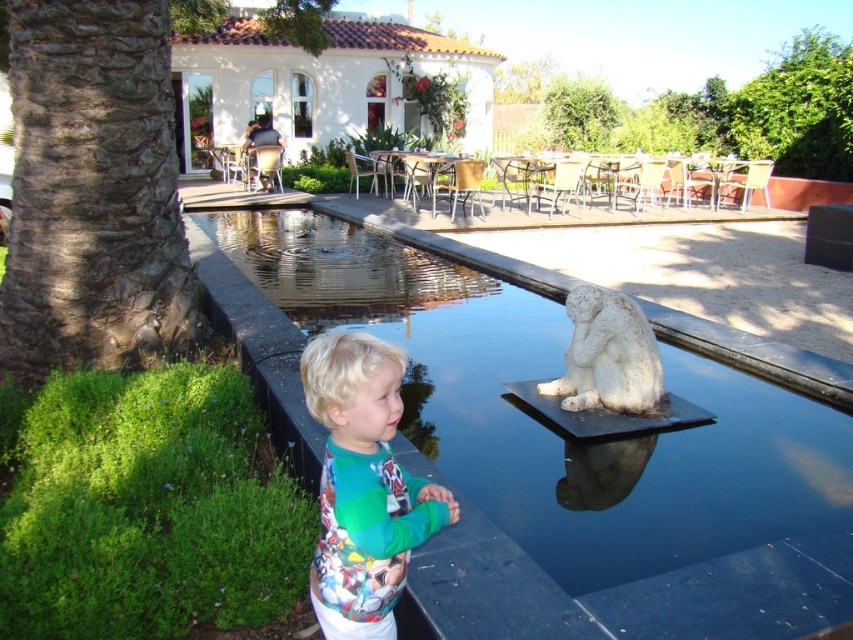
You are a photographer trying to capture the white stone statue at center without the smooth concrete pool at center appearing in the foreground. Is this possible given their positions?

The smooth concrete pool at center is in front of the white stone statue at center, so it would block the view. You cannot capture the statue without the pool in the foreground.

You are a parent trying to ensure your child stays safe near the water. The smooth concrete pool at center and the multicolored fleece sweater at lower left are in view. Which object is shorter and therefore poses a lower risk of the child slipping into the water?

The smooth concrete pool at center has a lesser height compared to the multicolored fleece sweater at lower left, so the smooth concrete pool at center is shorter and poses a lower risk of the child slipping into the water.